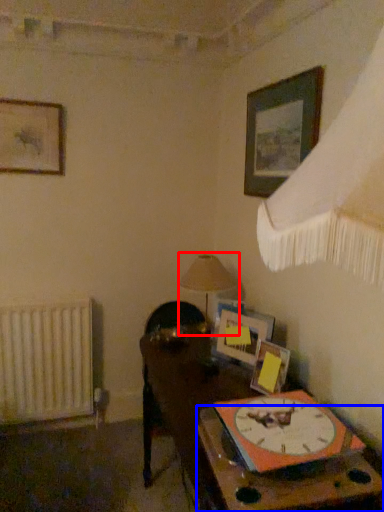
Question: Among these objects, which one is nearest to the camera, table lamp (highlighted by a red box) or table (highlighted by a blue box)?

Choices:
 (A) table lamp
 (B) table

Answer: (B)